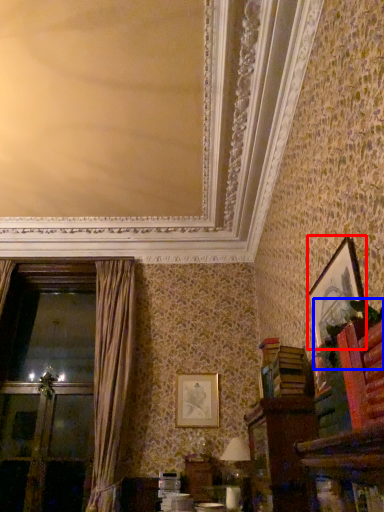
Question: Which of the following is the farthest to the observer, picture frame (highlighted by a red box) or plant (highlighted by a blue box)?

Choices:
 (A) picture frame
 (B) plant

Answer: (A)